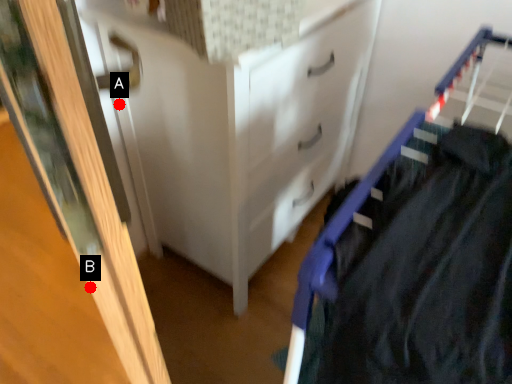
Question: Two points are circled on the image, labeled by A and B beside each circle. Which point appears farthest from the camera in this image?

Choices:
 (A) A is further
 (B) B is further

Answer: (A)